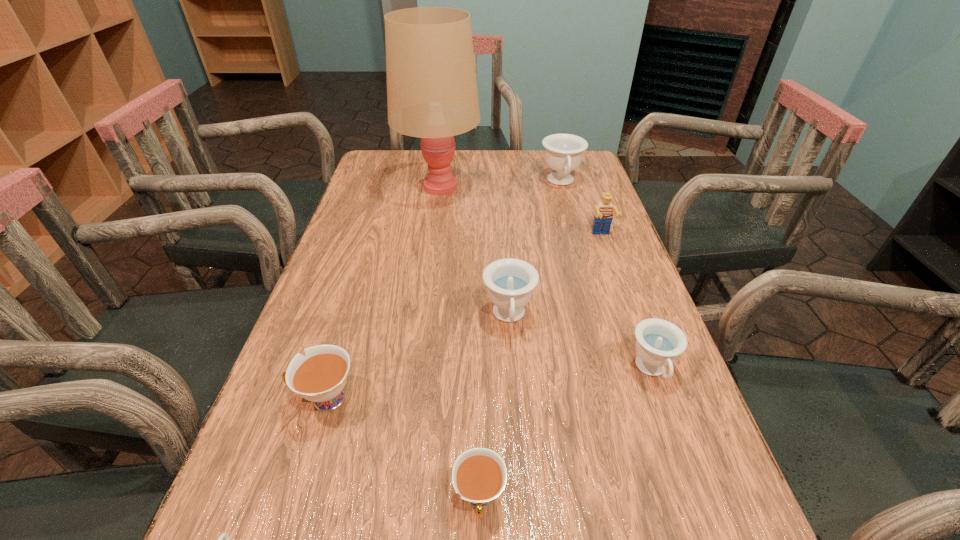
I want to click on lampshade that is positioned at the left edge, so click(432, 94).

What are the coordinates of `teacup that is positioned at the left edge` in the screenshot? It's located at (320, 377).

Locate an element on the screen. The width and height of the screenshot is (960, 540). Lego that is at the right edge is located at coordinates (603, 216).

Locate an element on the screen. Image resolution: width=960 pixels, height=540 pixels. object situated at the far left corner is located at coordinates (432, 94).

The width and height of the screenshot is (960, 540). In order to click on object at the far right corner in this screenshot , I will do tap(563, 152).

Locate an element on the screen. free space at the far edge is located at coordinates (541, 180).

In the image, there is a desktop. What are the coordinates of `vacant space at the left edge` in the screenshot? It's located at (264, 508).

Where is `free space at the right edge`? free space at the right edge is located at coordinates (578, 208).

I want to click on vacant region at the far right corner, so click(x=575, y=177).

Where is `vacant area that lies between the farthest blue teacup and the second farthest teacup`? vacant area that lies between the farthest blue teacup and the second farthest teacup is located at coordinates (535, 249).